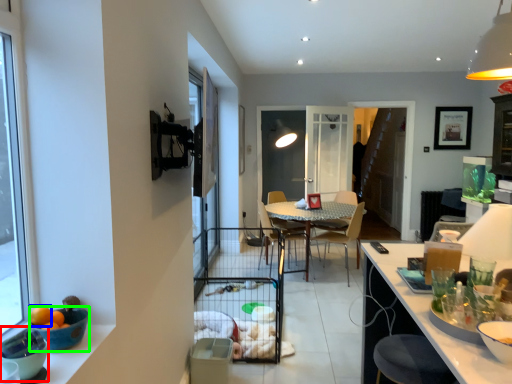
Question: Which object is positioned closest to bowl (highlighted by a red box)? Select from orange (highlighted by a blue box) and bowl (highlighted by a green box).

Choices:
 (A) orange
 (B) bowl

Answer: (A)